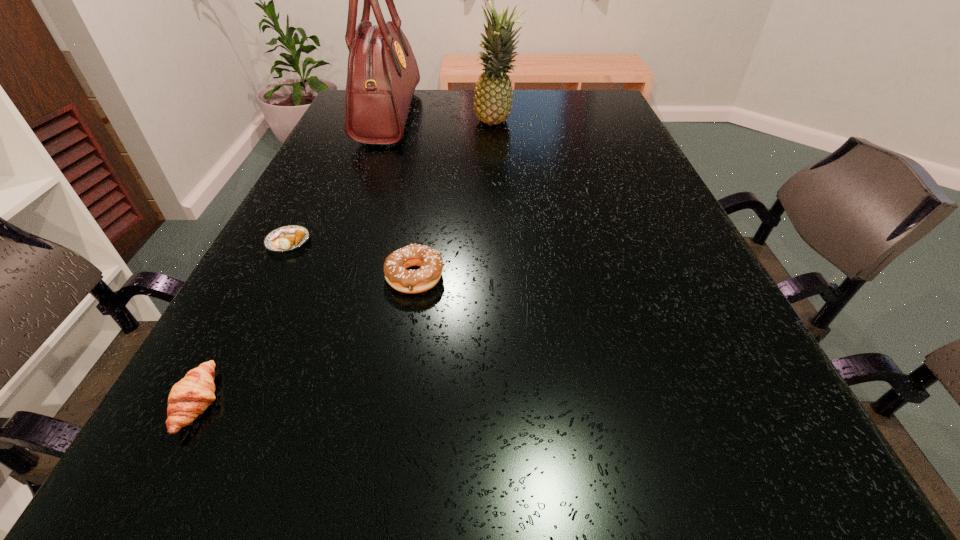
Where is `vacant space located 0.280m on the left of the pineapple`? This screenshot has height=540, width=960. vacant space located 0.280m on the left of the pineapple is located at coordinates (373, 123).

Where is `free space located 0.190m on the back of the doughnut`? Image resolution: width=960 pixels, height=540 pixels. free space located 0.190m on the back of the doughnut is located at coordinates (426, 201).

Where is `vacant point located on the front-facing side of the taller pastry`? This screenshot has height=540, width=960. vacant point located on the front-facing side of the taller pastry is located at coordinates (403, 402).

Locate an element on the screen. The height and width of the screenshot is (540, 960). free space located on the right of the farther pastry is located at coordinates 414,242.

Image resolution: width=960 pixels, height=540 pixels. Find the location of `handbag located at the far edge`. handbag located at the far edge is located at coordinates (383, 73).

Locate an element on the screen. pineapple situated at the far edge is located at coordinates (493, 94).

This screenshot has width=960, height=540. I want to click on handbag that is at the left edge, so click(383, 73).

Find the location of `object that is positioned at the far left corner`. object that is positioned at the far left corner is located at coordinates (383, 73).

This screenshot has width=960, height=540. In order to click on free space at the far edge of the desktop in this screenshot , I will do `click(533, 105)`.

In the image, there is a desktop. Find the location of `vacant space at the near edge`. vacant space at the near edge is located at coordinates (637, 519).